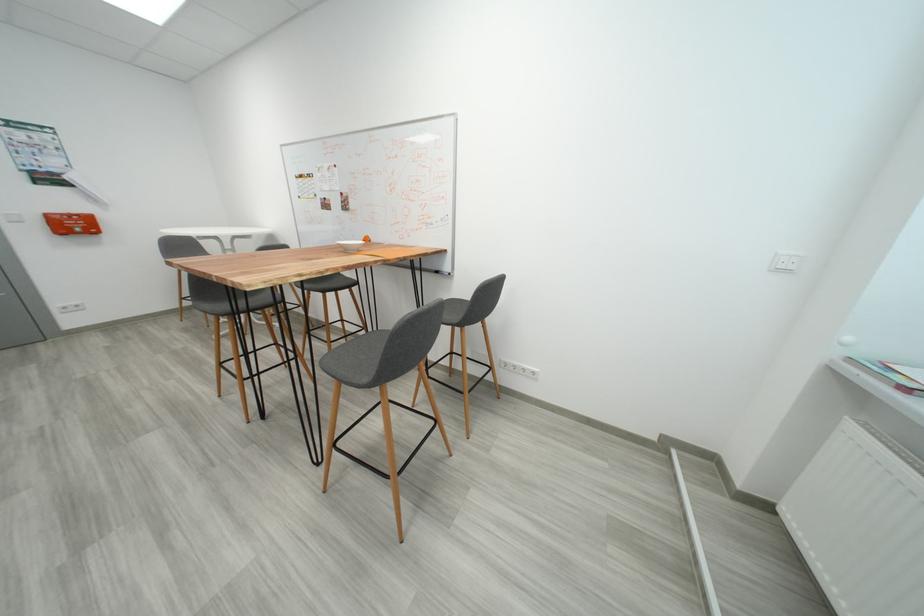
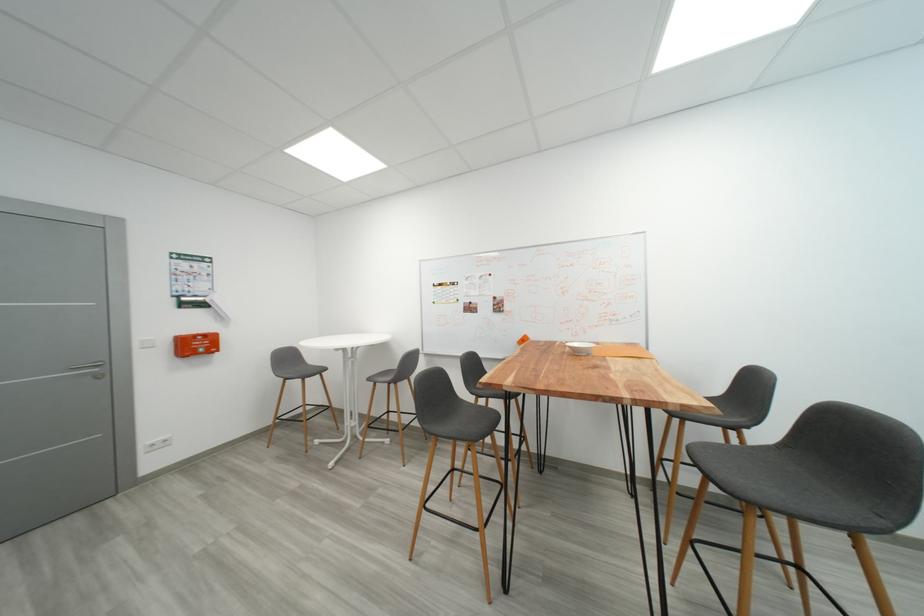
Question: The images are taken continuously from a first-person perspective. In which direction are you moving?

Choices:
 (A) Left
 (B) Right
 (C) Forward
 (D) Backward

Answer: (A)